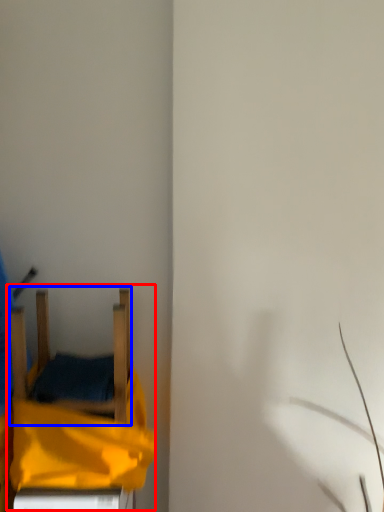
Question: Which point is closer to the camera, bed (highlighted by a red box) or furniture (highlighted by a blue box)?

Choices:
 (A) bed
 (B) furniture

Answer: (A)